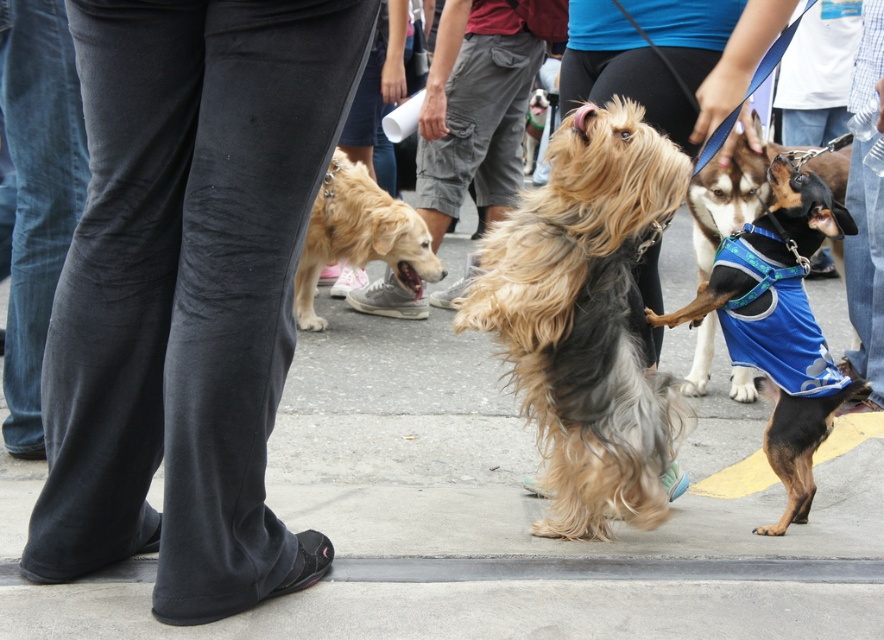
Question: Which point is farther to the camera?

Choices:
 (A) blue fabric dog at right
 (B) fuzzy fur dog at center
 (C) denim pants at lower left

Answer: (A)

Question: Where is fuzzy fur dog at center located in relation to golden fur dog at center in the image?

Choices:
 (A) below
 (B) above

Answer: (A)

Question: Does black and tan fabric dog at center right lie behind golden fur dog at center?

Choices:
 (A) no
 (B) yes

Answer: (A)

Question: Which point is farther to the camera?

Choices:
 (A) tap(67, 80)
 (B) tap(743, 433)
 (C) tap(280, 84)
 (D) tap(397, 260)

Answer: (D)

Question: Which point is closer to the camera taking this photo?

Choices:
 (A) (303, 316)
 (B) (540, 232)

Answer: (B)

Question: Is denim pants at lower left bigger than blue fabric dog at right?

Choices:
 (A) yes
 (B) no

Answer: (B)